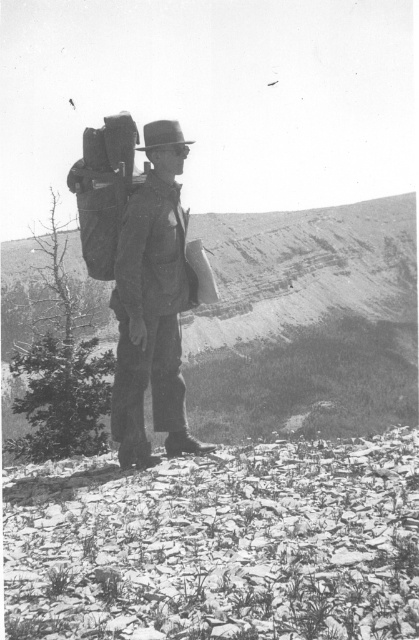
Is point (369, 200) closer to viewer compared to point (150, 177)?

No, it is behind (150, 177).

Locate an element on the screen. This screenshot has width=419, height=640. smooth dirt hillside at center is located at coordinates (305, 321).